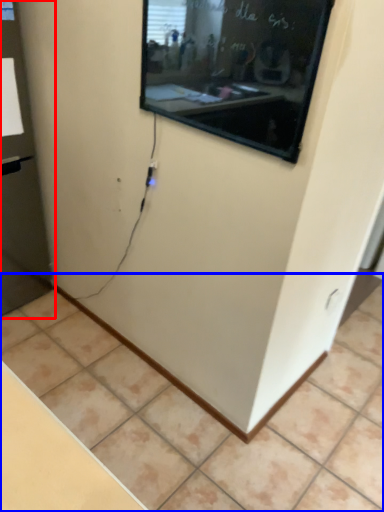
Question: Which object is closer to the camera taking this photo, glass door (highlighted by a red box) or tile (highlighted by a blue box)?

Choices:
 (A) glass door
 (B) tile

Answer: (B)